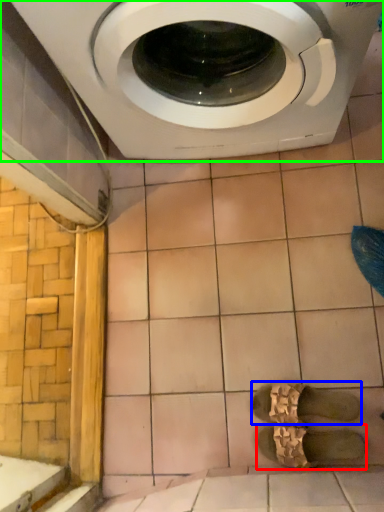
Question: Which is farther away from shoe (highlighted by a red box)? shoe (highlighted by a blue box) or washing machine (highlighted by a green box)?

Choices:
 (A) shoe
 (B) washing machine

Answer: (B)